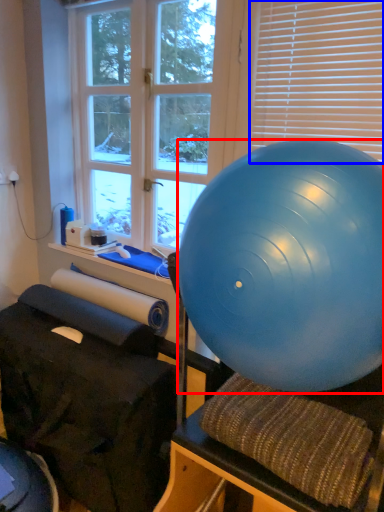
Question: Which of the following is the closest to the observer, ball (highlighted by a red box) or blind (highlighted by a blue box)?

Choices:
 (A) ball
 (B) blind

Answer: (A)